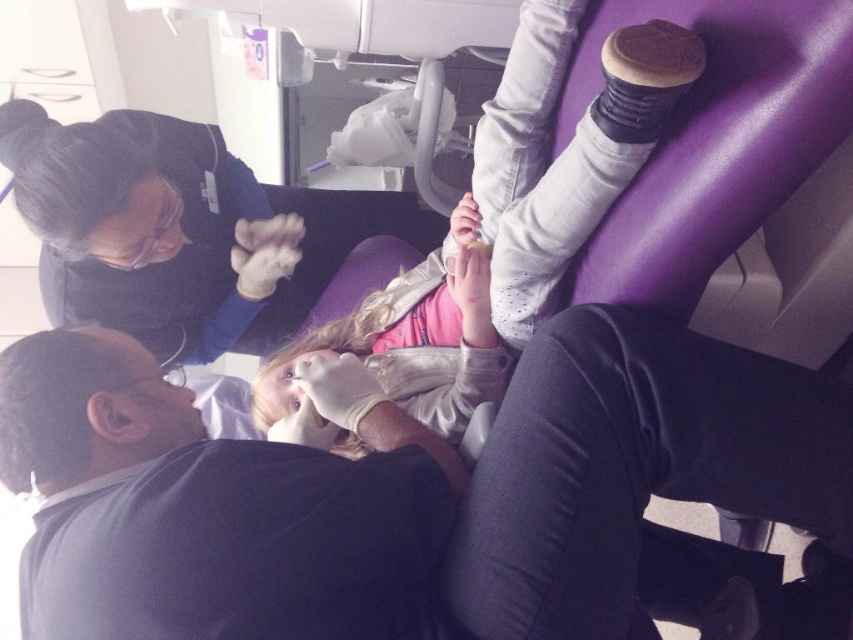
Which of these two, dark gray shirt at upper left or light pink fabric at center, stands shorter?

dark gray shirt at upper left

Between point (624, 412) and point (576, 248), which one is positioned behind?

The point (576, 248) is more distant.

Find the location of a particular element. dark gray shirt at upper left is located at coordinates (402, 492).